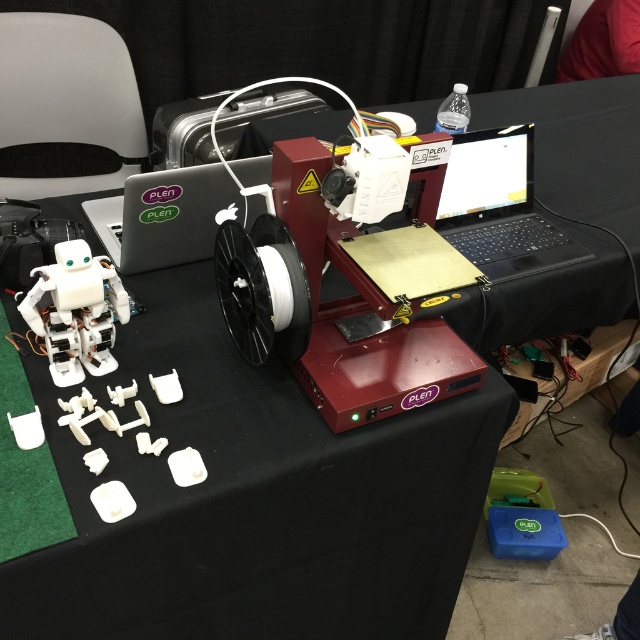
Question: Is matte black laptop at upper right below white plastic robot at lower left?

Choices:
 (A) no
 (B) yes

Answer: (A)

Question: Does matte black laptop at upper right have a greater width compared to satin black laptop at center?

Choices:
 (A) no
 (B) yes

Answer: (A)

Question: Does satin black laptop at center appear on the left side of white plastic robot at lower left?

Choices:
 (A) yes
 (B) no

Answer: (B)

Question: Which of these objects is positioned farthest from the white plastic robot at lower left?

Choices:
 (A) matte black laptop at upper right
 (B) satin black laptop at center

Answer: (A)

Question: Estimate the real-world distances between objects in this image. Which object is farther from the matte black laptop at upper right?

Choices:
 (A) white plastic robot at lower left
 (B) satin black laptop at center

Answer: (A)

Question: Which object is positioned farthest from the matte black laptop at upper right?

Choices:
 (A) white plastic robot at lower left
 (B) satin black laptop at center

Answer: (A)